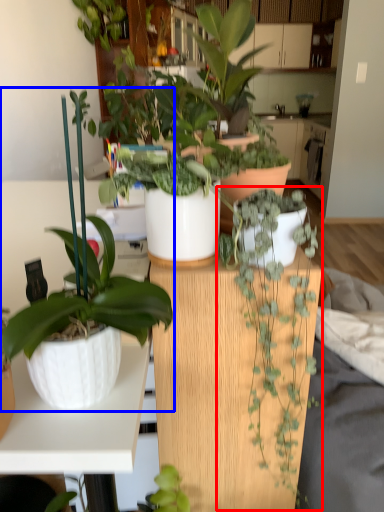
Question: Among these objects, which one is nearest to the camera, houseplant (highlighted by a red box) or houseplant (highlighted by a blue box)?

Choices:
 (A) houseplant
 (B) houseplant

Answer: (B)